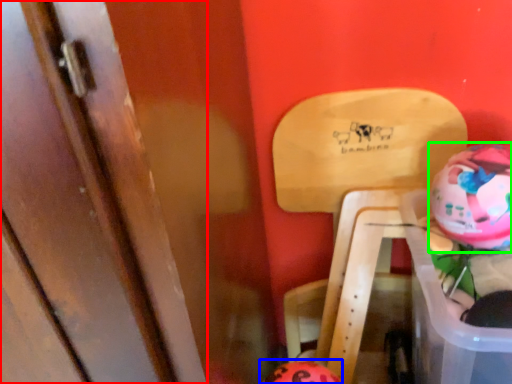
Question: Considering the real-world distances, which object is closest to door (highlighted by a red box)? piggy bank (highlighted by a blue box) or piggy bank (highlighted by a green box).

Choices:
 (A) piggy bank
 (B) piggy bank

Answer: (A)